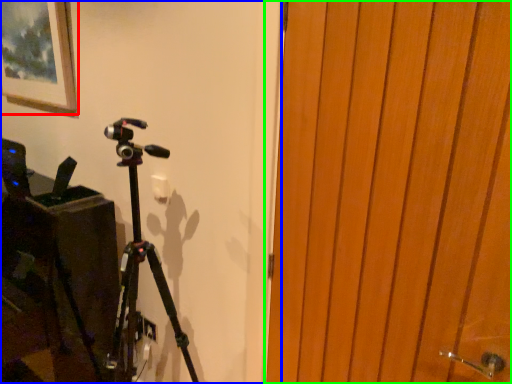
Question: Which object is positioned closest to picture frame (highlighted by a red box)? Select from backdrop (highlighted by a blue box) and door (highlighted by a green box).

Choices:
 (A) backdrop
 (B) door

Answer: (A)